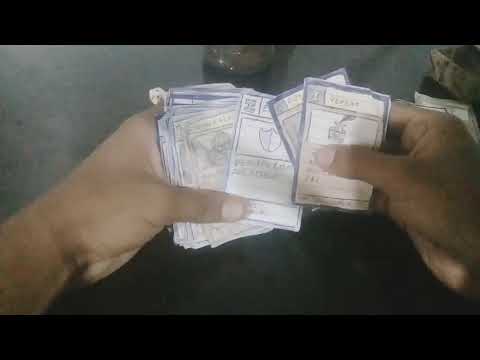
Locate an element on the screen. This screenshot has height=360, width=480. clear container is located at coordinates (239, 58).